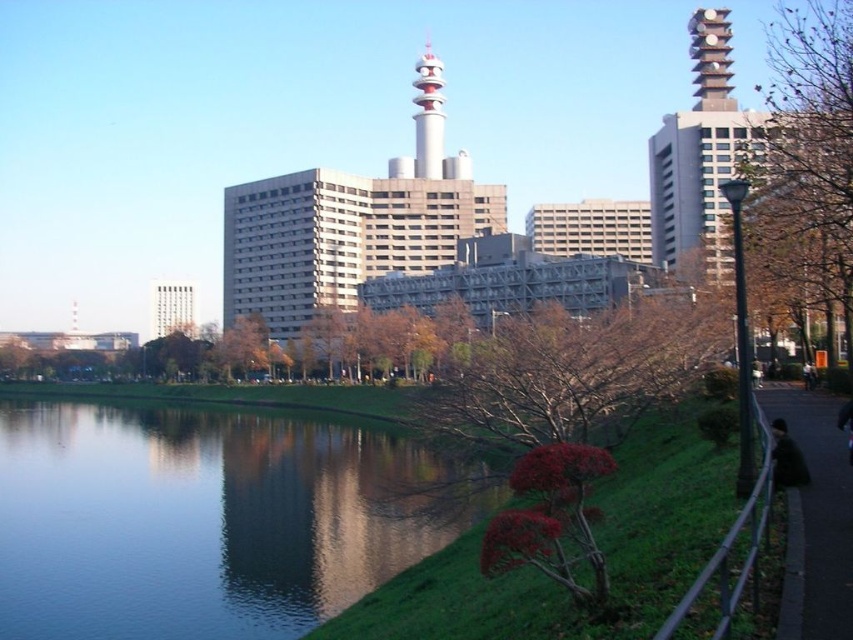
Question: Is red textured bush at center further to camera compared to bare branches at right?

Choices:
 (A) yes
 (B) no

Answer: (B)

Question: Which of the following is the closest to the observer?

Choices:
 (A) smooth water at lower left
 (B) red textured bush at center
 (C) dark fabric jacket at lower right
 (D) bare branches at right

Answer: (B)

Question: Which of the following is the closest to the observer?

Choices:
 (A) bare branches at right
 (B) dark fabric jacket at lower right
 (C) smooth water at lower left

Answer: (B)

Question: Is smooth water at lower left thinner than black fabric at lower right?

Choices:
 (A) yes
 (B) no

Answer: (B)

Question: Does matte white tower at left have a smaller size compared to dark fabric jacket at lower right?

Choices:
 (A) no
 (B) yes

Answer: (A)

Question: Which point is farther from the camera taking this photo?

Choices:
 (A) 225,218
 (B) 788,458
 (C) 602,314
 (D) 317,436

Answer: (A)